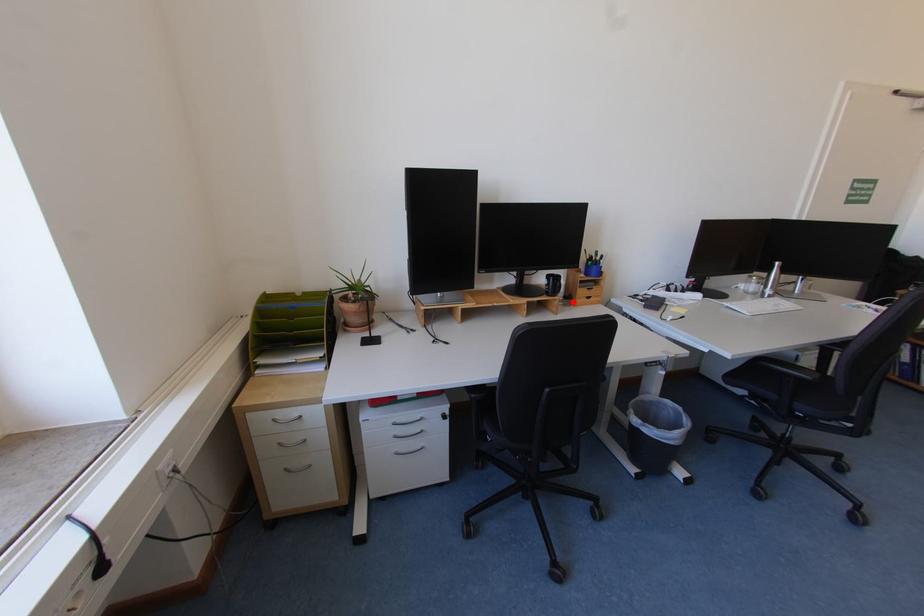
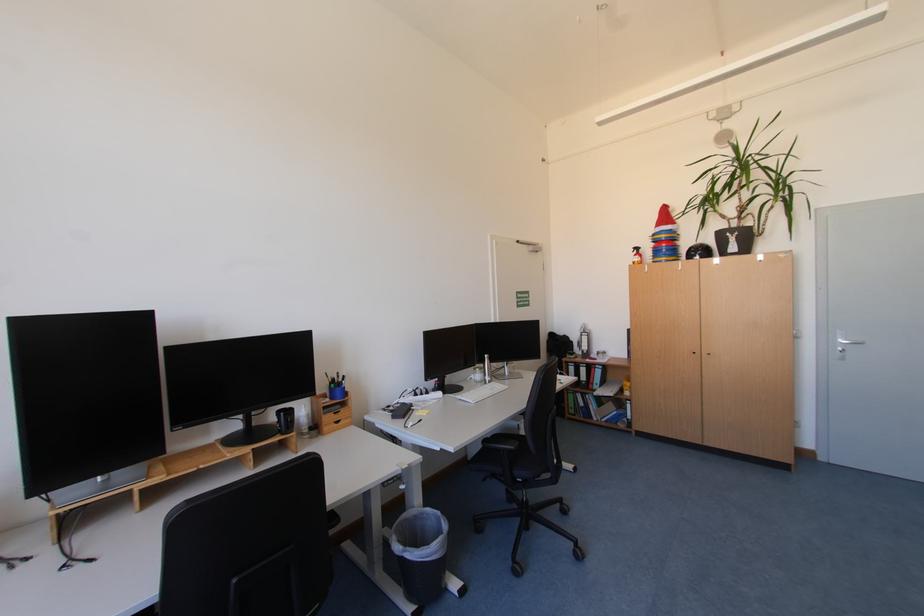
Where in the second image is the point corresponding to the highlighted location from the first image?

(321, 432)